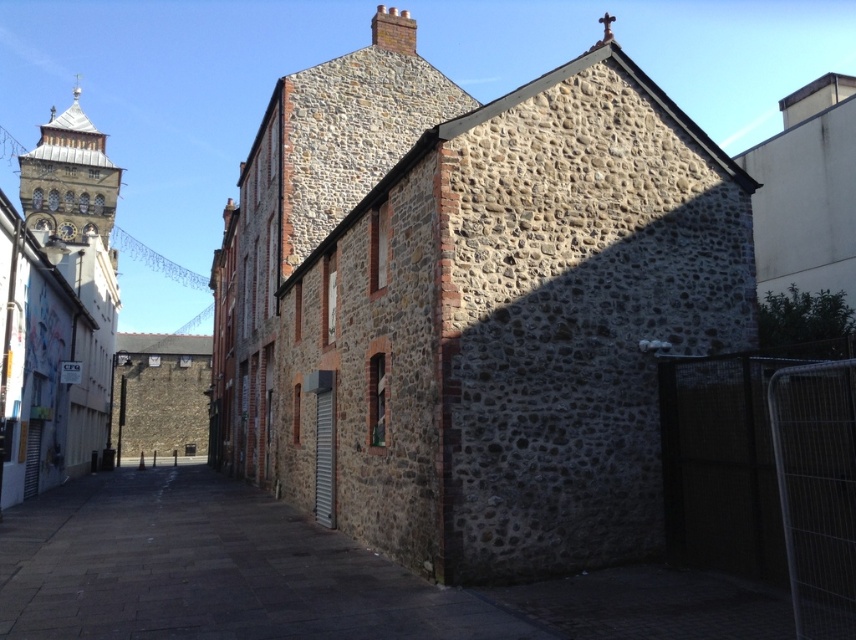
You are standing in the dark stone alley at center and want to look up at the stone clock tower at upper left. Can you see the clock tower from your current position?

Yes, because the dark stone alley at center is located below the stone clock tower at upper left, so looking up from the alley would allow you to see the clock tower.